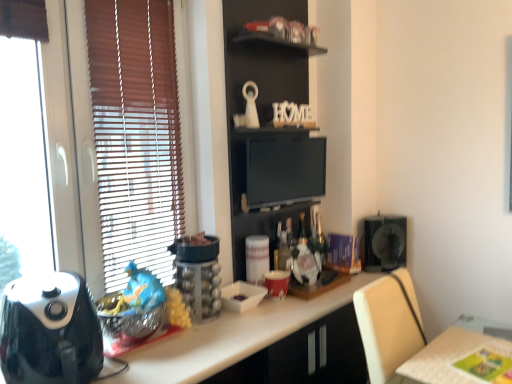
Question: Can you confirm if wooden bookshelf at upper center is smaller than white paper towel holder at center, the 2th appliance in the back-to-front sequence?

Choices:
 (A) no
 (B) yes

Answer: (A)

Question: Is wooden bookshelf at upper center at the right side of white paper towel holder at center, the 2th appliance in the back-to-front sequence?

Choices:
 (A) yes
 (B) no

Answer: (A)

Question: Does wooden bookshelf at upper center have a larger size compared to white paper towel holder at center, which is the 4th appliance in left-to-right order?

Choices:
 (A) no
 (B) yes

Answer: (B)

Question: Is white paper towel holder at center, marked as the third appliance in a right-to-left arrangement, surrounded by wooden bookshelf at upper center?

Choices:
 (A) no
 (B) yes

Answer: (B)

Question: Is wooden bookshelf at upper center looking in the opposite direction of white paper towel holder at center, marked as the third appliance in a right-to-left arrangement?

Choices:
 (A) no
 (B) yes

Answer: (B)

Question: Choose the correct answer: Is light brown wooden table at lower right inside matte red cup at center, positioned as the fourth appliance in front-to-back order, or outside it?

Choices:
 (A) outside
 (B) inside

Answer: (A)

Question: From the image's perspective, is light brown wooden table at lower right positioned above or below matte red cup at center, arranged as the 2th appliance when viewed from the right?

Choices:
 (A) above
 (B) below

Answer: (B)

Question: Is point (479, 379) positioned closer to the camera than point (271, 296)?

Choices:
 (A) farther
 (B) closer

Answer: (B)

Question: In terms of size, does light brown wooden table at lower right appear bigger or smaller than matte red cup at center, the fifth appliance from the left?

Choices:
 (A) small
 (B) big

Answer: (B)

Question: From the image's perspective, is white glossy bowl at center, the third appliance from the front, located above or below matte black monitor at center?

Choices:
 (A) above
 (B) below

Answer: (B)

Question: In terms of width, does white glossy bowl at center, the third appliance from the front, look wider or thinner when compared to matte black monitor at center?

Choices:
 (A) thin
 (B) wide

Answer: (B)

Question: Is white glossy bowl at center, which is the third appliance from left to right, inside the boundaries of matte black monitor at center, or outside?

Choices:
 (A) outside
 (B) inside

Answer: (A)

Question: Considering the positions of white glossy bowl at center, the fourth appliance when ordered from back to front, and matte black monitor at center in the image, is white glossy bowl at center, the fourth appliance when ordered from back to front, taller or shorter than matte black monitor at center?

Choices:
 (A) tall
 (B) short

Answer: (B)

Question: Would you say metallic silver blender at left, the 5th appliance positioned from the right, is to the left or to the right of white glossy countertop at center in the picture?

Choices:
 (A) right
 (B) left

Answer: (B)

Question: In terms of height, does metallic silver blender at left, the second appliance from the front, look taller or shorter compared to white glossy countertop at center?

Choices:
 (A) tall
 (B) short

Answer: (B)